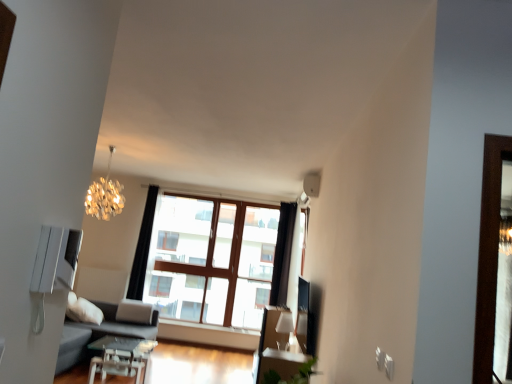
Question: Is white glossy lampshade at upper center, the second lamp when ordered from left to right, completely or partially outside of shiny metallic chandelier at upper left, which ranks as the first lamp in top-to-bottom order?

Choices:
 (A) yes
 (B) no

Answer: (A)

Question: Is white glossy lampshade at upper center, the second lamp when ordered from left to right, at the right side of shiny metallic chandelier at upper left, acting as the second lamp starting from the right?

Choices:
 (A) yes
 (B) no

Answer: (A)

Question: Is the position of white glossy lampshade at upper center, which ranks as the second lamp in top-to-bottom order, less distant than that of shiny metallic chandelier at upper left, the 1th lamp from the left?

Choices:
 (A) no
 (B) yes

Answer: (A)

Question: Is white glossy lampshade at upper center, the 1th lamp when ordered from bottom to top, positioned with its back to shiny metallic chandelier at upper left, which is the second lamp in bottom-to-top order?

Choices:
 (A) no
 (B) yes

Answer: (A)

Question: Considering the relative sizes of white glossy lampshade at upper center, which ranks as the second lamp in top-to-bottom order, and shiny metallic chandelier at upper left, acting as the second lamp starting from the right, in the image provided, is white glossy lampshade at upper center, which ranks as the second lamp in top-to-bottom order, taller than shiny metallic chandelier at upper left, acting as the second lamp starting from the right,?

Choices:
 (A) yes
 (B) no

Answer: (B)

Question: Choose the correct answer: Is shiny metallic chandelier at upper left, acting as the second lamp starting from the right, inside black fabric curtain at center or outside it?

Choices:
 (A) inside
 (B) outside

Answer: (B)

Question: From a real-world perspective, relative to black fabric curtain at center, is shiny metallic chandelier at upper left, which ranks as the first lamp in top-to-bottom order, vertically above or below?

Choices:
 (A) below
 (B) above

Answer: (B)

Question: Looking at the image, does shiny metallic chandelier at upper left, which is the second lamp in bottom-to-top order, seem bigger or smaller compared to black fabric curtain at center?

Choices:
 (A) small
 (B) big

Answer: (B)

Question: Is shiny metallic chandelier at upper left, acting as the second lamp starting from the right, taller or shorter than black fabric curtain at center?

Choices:
 (A) short
 (B) tall

Answer: (A)

Question: From the image's perspective, is transparent glass table at center located above or below white glossy lampshade at upper center, the second lamp when ordered from left to right?

Choices:
 (A) below
 (B) above

Answer: (A)

Question: Considering the positions of transparent glass table at center and white glossy lampshade at upper center, the 1th lamp when ordered from bottom to top, in the image, is transparent glass table at center bigger or smaller than white glossy lampshade at upper center, the 1th lamp when ordered from bottom to top,?

Choices:
 (A) small
 (B) big

Answer: (B)

Question: Does point (89, 344) appear closer or farther from the camera than point (282, 324)?

Choices:
 (A) closer
 (B) farther

Answer: (A)

Question: Visually, is transparent glass table at center positioned to the left or to the right of white glossy lampshade at upper center, the second lamp when ordered from left to right?

Choices:
 (A) left
 (B) right

Answer: (A)

Question: From a real-world perspective, is white glossy lampshade at upper center, the 1th lamp when ordered from bottom to top, above or below dark gray fabric couch at lower left?

Choices:
 (A) below
 (B) above

Answer: (B)

Question: Does point (287, 334) appear closer or farther from the camera than point (150, 332)?

Choices:
 (A) closer
 (B) farther

Answer: (B)